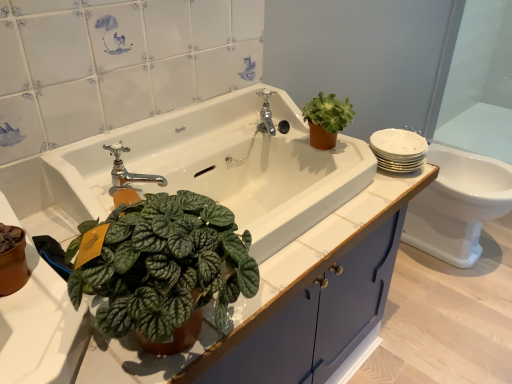
Question: From the image's perspective, relative to white glossy toilet at right, is white glossy sink at center above or below?

Choices:
 (A) below
 (B) above

Answer: (B)

Question: Would you say white glossy sink at center is to the left or to the right of white glossy toilet at right in the picture?

Choices:
 (A) right
 (B) left

Answer: (B)

Question: Which of these objects is positioned closest to the polished chrome tap at upper center, which is the first tap in back-to-front order?

Choices:
 (A) white glossy toilet at right
 (B) transparent glass door at upper right
 (C) green matte succulent at upper right
 (D) blue matte cabinet at center
 (E) white glossy sink at center

Answer: (C)

Question: Which object is positioned farthest from the polished chrome faucet at center, the second tap positioned from the top?

Choices:
 (A) white glossy sink at center
 (B) white glossy toilet at right
 (C) green matte succulent at upper right
 (D) polished chrome tap at upper center, the first tap positioned from the right
 (E) blue matte cabinet at center

Answer: (B)